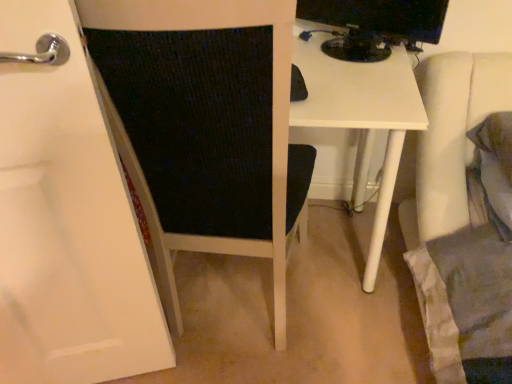
Find the location of a particular element. Image resolution: width=512 pixels, height=384 pixels. free space in front of black fabric chair at left is located at coordinates (272, 339).